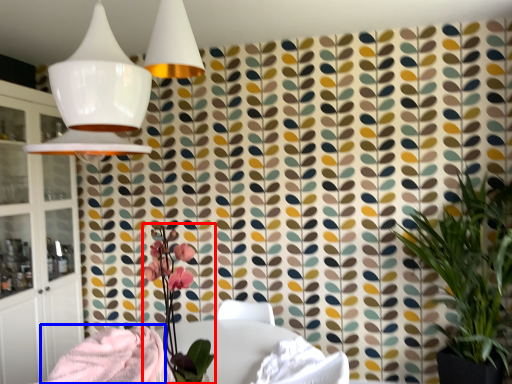
Question: Which object is closer to the camera taking this photo, floral arrangement (highlighted by a red box) or blanket (highlighted by a blue box)?

Choices:
 (A) floral arrangement
 (B) blanket

Answer: (A)